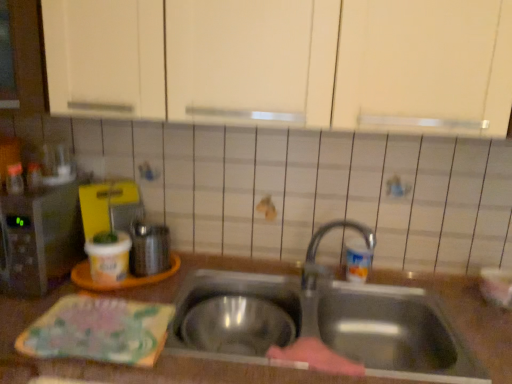
Question: Would you say shiny metallic kettle at left, which ranks as the first appliance in right-to-left order, is part of stainless steel sink at center's contents?

Choices:
 (A) yes
 (B) no

Answer: (B)

Question: Is stainless steel sink at center not within shiny metallic kettle at left, the 2th appliance when ordered from left to right?

Choices:
 (A) yes
 (B) no

Answer: (A)

Question: Could you tell me if stainless steel sink at center is turned towards shiny metallic kettle at left, which ranks as the first appliance in right-to-left order?

Choices:
 (A) no
 (B) yes

Answer: (A)

Question: From the image's perspective, is stainless steel sink at center under shiny metallic kettle at left, the 2th appliance when ordered from left to right?

Choices:
 (A) yes
 (B) no

Answer: (A)

Question: Can you confirm if stainless steel sink at center is wider than shiny metallic kettle at left, which ranks as the first appliance in right-to-left order?

Choices:
 (A) yes
 (B) no

Answer: (A)

Question: Is shiny metallic kettle at left, the 2th appliance when ordered from left to right, in front of or behind stainless steel sink at center in the image?

Choices:
 (A) front
 (B) behind

Answer: (B)

Question: From a real-world perspective, relative to stainless steel sink at center, is shiny metallic kettle at left, the 2th appliance when ordered from left to right, vertically above or below?

Choices:
 (A) below
 (B) above

Answer: (B)

Question: Looking at the image, does shiny metallic kettle at left, which ranks as the first appliance in right-to-left order, seem bigger or smaller compared to stainless steel sink at center?

Choices:
 (A) small
 (B) big

Answer: (A)

Question: Is shiny metallic kettle at left, which ranks as the first appliance in right-to-left order, wider or thinner than stainless steel sink at center?

Choices:
 (A) wide
 (B) thin

Answer: (B)

Question: Is stainless steel sink at center situated inside brown matte countertop at center or outside?

Choices:
 (A) outside
 (B) inside

Answer: (B)

Question: Visually, is stainless steel sink at center positioned to the left or to the right of brown matte countertop at center?

Choices:
 (A) right
 (B) left

Answer: (A)

Question: Is stainless steel sink at center bigger or smaller than brown matte countertop at center?

Choices:
 (A) big
 (B) small

Answer: (B)

Question: In terms of width, does stainless steel sink at center look wider or thinner when compared to brown matte countertop at center?

Choices:
 (A) thin
 (B) wide

Answer: (A)

Question: Looking at their shapes, would you say brown matte countertop at center is wider or thinner than metallic microwave at left, the second appliance positioned from the right?

Choices:
 (A) thin
 (B) wide

Answer: (B)

Question: From the image's perspective, is brown matte countertop at center located above or below metallic microwave at left, marked as the first appliance in a left-to-right arrangement?

Choices:
 (A) above
 (B) below

Answer: (B)